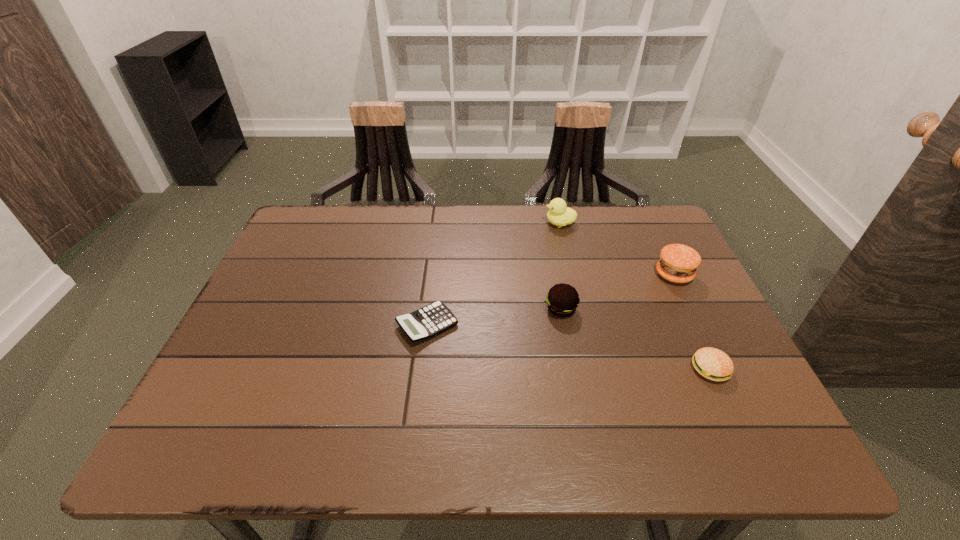
The width and height of the screenshot is (960, 540). What are the coordinates of `vacant space situated 0.370m at the beak of the duckling` in the screenshot? It's located at (424, 223).

You are a GUI agent. You are given a task and a screenshot of the screen. Output one action in this format:
    pyautogui.click(x=<x>, y=<y>)
    Task: Click on the free space located 0.320m at the beak of the duckling
    
    Given the screenshot: What is the action you would take?
    pyautogui.click(x=441, y=223)

You are a GUI agent. You are given a task and a screenshot of the screen. Output one action in this format:
    pyautogui.click(x=<x>, y=<y>)
    Task: Click on the free space located 0.390m on the front of the farthest patty
    The image size is (960, 540).
    Given the screenshot: What is the action you would take?
    pyautogui.click(x=748, y=426)

Image resolution: width=960 pixels, height=540 pixels. I want to click on vacant space located 0.370m on the left of the third tallest object, so click(x=394, y=309).

Find the location of a particular element. The image size is (960, 540). free space located on the left of the nearest patty is located at coordinates 632,369.

Locate an element on the screen. free spot located 0.140m on the back of the calculator is located at coordinates (434, 267).

Locate an element on the screen. This screenshot has width=960, height=540. object positioned at the far edge is located at coordinates (559, 214).

You are a GUI agent. You are given a task and a screenshot of the screen. Output one action in this format:
    pyautogui.click(x=<x>, y=<y>)
    Task: Click on the vacant space at the far edge of the desktop
    The height and width of the screenshot is (540, 960).
    Given the screenshot: What is the action you would take?
    coord(581,208)

At what (x,y) coordinates should I click in order to perform the action: click on vacant space at the near edge of the desktop. Please return your answer as a coordinate pair (x, y). Image resolution: width=960 pixels, height=540 pixels. Looking at the image, I should click on (309, 445).

This screenshot has width=960, height=540. In order to click on free space at the left edge of the desktop in this screenshot , I will do `click(278, 390)`.